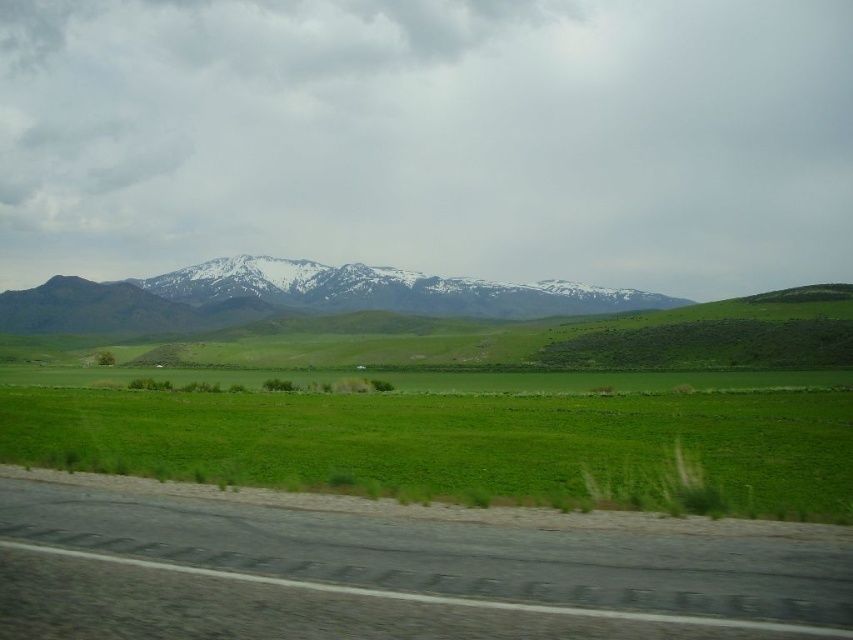
Looking at this image, between black asphalt road at lower left and green grass at lower center, which one has less height?

Standing shorter between the two is black asphalt road at lower left.

Can you confirm if black asphalt road at lower left is wider than green grass at lower center?

No.

This screenshot has height=640, width=853. Find the location of `black asphalt road at lower left`. black asphalt road at lower left is located at coordinates (389, 576).

Identify the location of black asphalt road at lower left. (389, 576).

Is point (109, 445) more distant than point (221, 324)?

That is False.

From the picture: Is green grass at lower center taller than snow-covered mountain range at upper center?

No.

Between point (103, 428) and point (252, 280), which one is positioned behind?

Positioned behind is point (252, 280).

The width and height of the screenshot is (853, 640). I want to click on green grass at lower center, so click(445, 440).

Who is more distant from viewer, (178, 632) or (560, 298)?

The point (560, 298) is more distant.

Between black asphalt road at lower left and snow-covered mountain range at upper center, which one has less height?

With less height is black asphalt road at lower left.

This screenshot has width=853, height=640. Find the location of `black asphalt road at lower left`. black asphalt road at lower left is located at coordinates point(389,576).